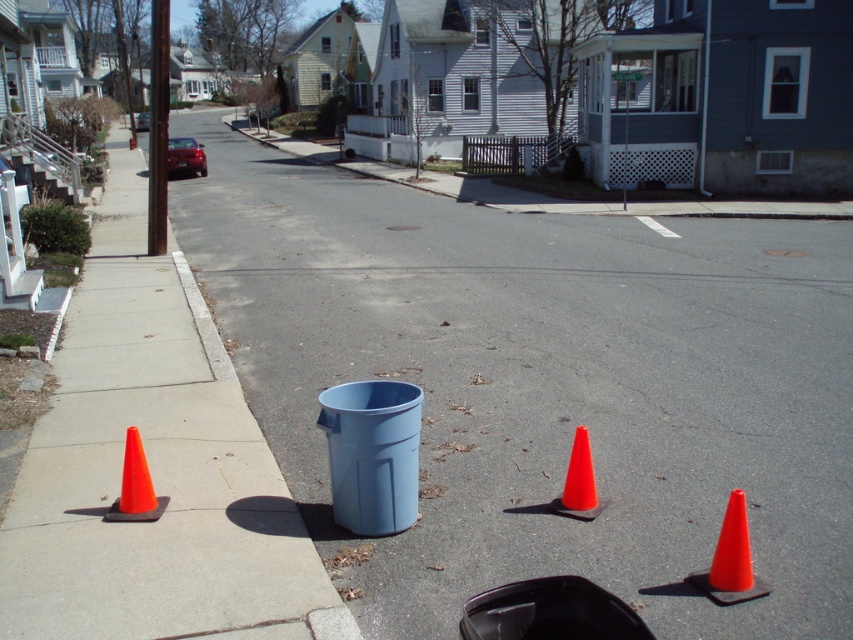
You are standing at the center of the residential street and see the orange plastic cone at left. Based on its position, can you determine if it is closer to the light blue trash bin or farther away compared to other cones?

The orange plastic cone at left is located at point (154, 467), which means it is closer to the light blue trash bin than the other cones.

You are a delivery person trying to place a small package next to the trash bin. The package is 1.2 meters tall. Can you safely place it between the orange plastic cones at left and orange plastic cone at left without it toppling over?

The orange plastic cones at left is much taller than orange plastic cone at left. The height difference between them means the ground between them might not be level, so placing a 1.2 meters tall package there could cause it to topple over. Choose a flatter area instead.